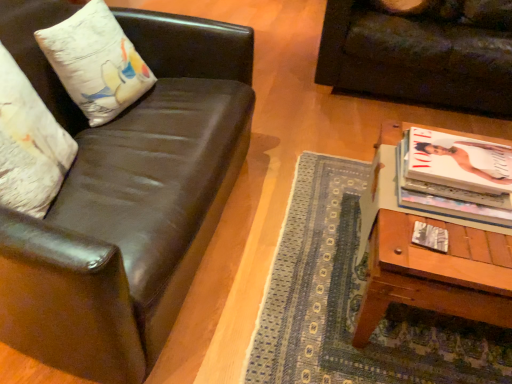
Image resolution: width=512 pixels, height=384 pixels. In order to click on vacant area located to the right-hand side of shiny black leather couch at left, which is the 1th studio couch from front to back in this screenshot , I will do `click(296, 227)`.